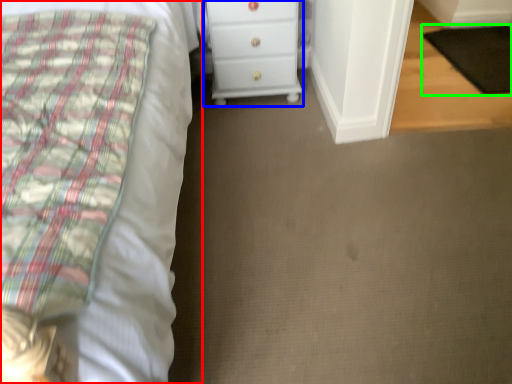
Question: Estimate the real-world distances between objects in this image. Which object is closer to bed (highlighted by a red box), chest of drawers (highlighted by a blue box) or pad (highlighted by a green box)?

Choices:
 (A) chest of drawers
 (B) pad

Answer: (A)